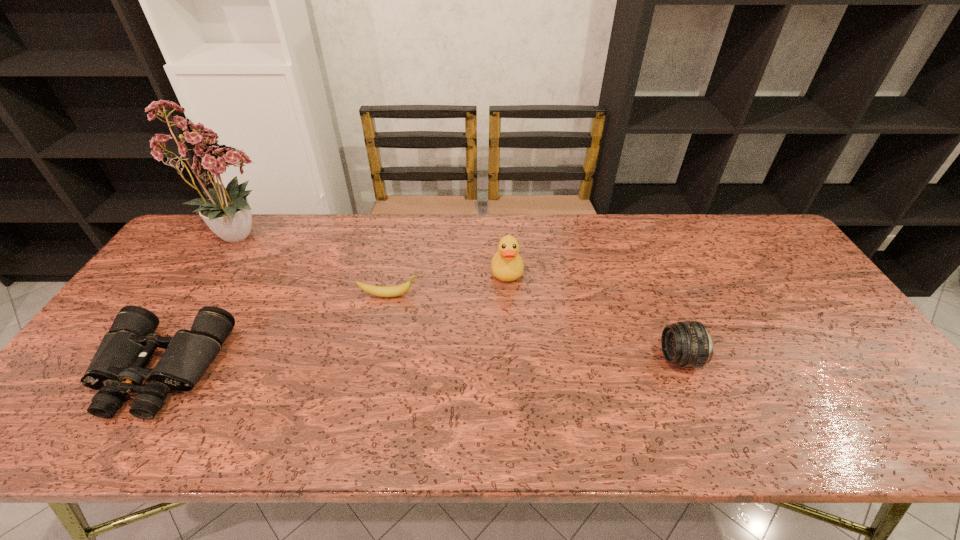
Where is `vacant space that satisfies the following two spatial constraints: 1. at the beak of the fourth shortest object; 2. at the stem of the banana`? vacant space that satisfies the following two spatial constraints: 1. at the beak of the fourth shortest object; 2. at the stem of the banana is located at coordinates (509, 295).

Identify the location of vacant space that satisfies the following two spatial constraints: 1. at the stem of the third nearest object; 2. through the eyepieces of the binoculars. tap(374, 370).

At what (x,y) coordinates should I click in order to perform the action: click on vacant area in the image that satisfies the following two spatial constraints: 1. at the front element of the rightmost object; 2. through the eyepieces of the binoculars. Please return your answer as a coordinate pair (x, y). This screenshot has height=540, width=960. Looking at the image, I should click on click(684, 370).